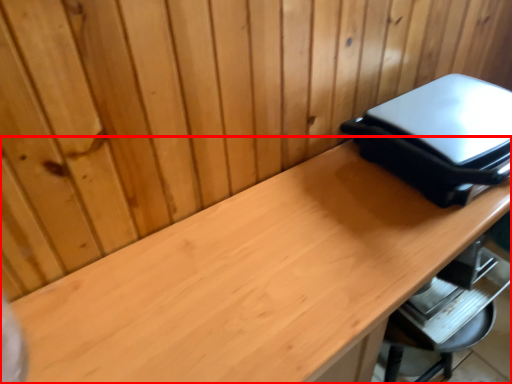
Question: Where is desk (annotated by the red box) located in relation to appliance in the image?

Choices:
 (A) right
 (B) left

Answer: (B)